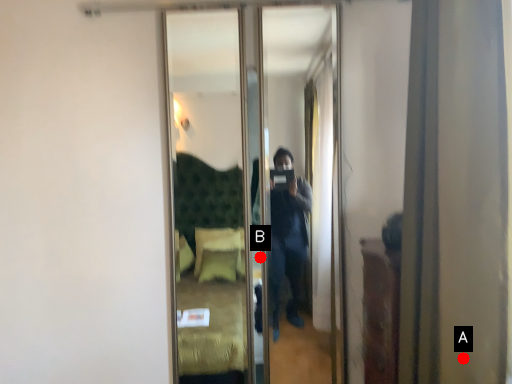
Question: Two points are circled on the image, labeled by A and B beside each circle. Which point is farther from the camera taking this photo?

Choices:
 (A) A is further
 (B) B is further

Answer: (B)